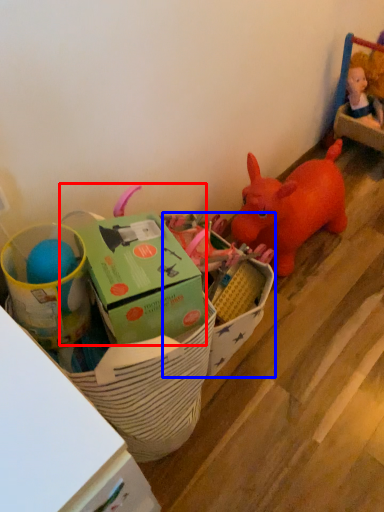
Question: Which object is further to the camera taking this photo, toy (highlighted by a red box) or storage box (highlighted by a blue box)?

Choices:
 (A) toy
 (B) storage box

Answer: (B)